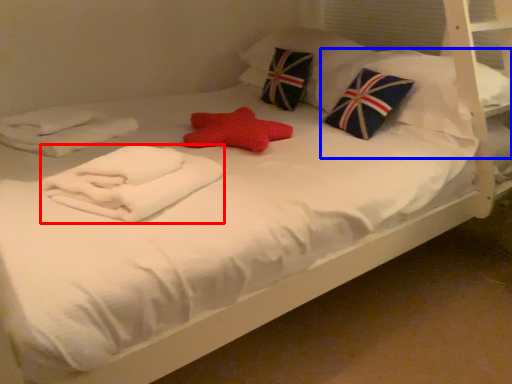
Question: Which object appears farthest to the camera in this image, material (highlighted by a red box) or pillow (highlighted by a blue box)?

Choices:
 (A) material
 (B) pillow

Answer: (B)